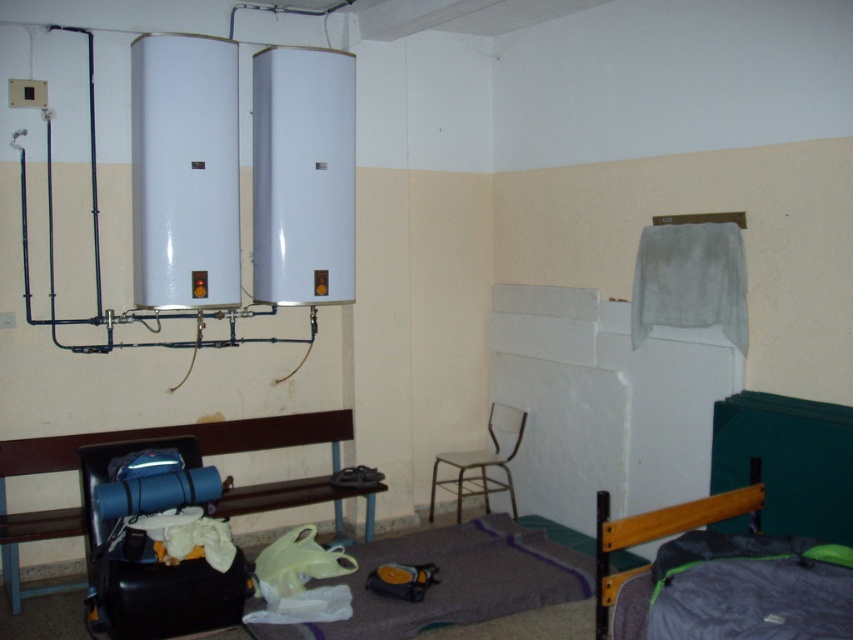
Measure the distance from black leather bench at lower left to metallic white chair at center.

The distance of black leather bench at lower left from metallic white chair at center is 36.89 inches.

Who is higher up, black leather bench at lower left or metallic white chair at center?

black leather bench at lower left is above.

The image size is (853, 640). What do you see at coordinates (137, 440) in the screenshot? I see `black leather bench at lower left` at bounding box center [137, 440].

You are a GUI agent. You are given a task and a screenshot of the screen. Output one action in this format:
    pyautogui.click(x=<x>, y=<y>)
    Task: Click on the black leather bench at lower left
    This screenshot has height=640, width=853.
    Given the screenshot: What is the action you would take?
    pyautogui.click(x=137, y=440)

Does dark gray fabric bed at lower right have a lesser height compared to black leather bench at lower left?

Correct, dark gray fabric bed at lower right is not as tall as black leather bench at lower left.

The width and height of the screenshot is (853, 640). I want to click on dark gray fabric bed at lower right, so click(x=720, y=577).

Is point (820, 611) closer to camera compared to point (24, 440)?

Yes, point (820, 611) is closer to viewer.

You are a GUI agent. You are given a task and a screenshot of the screen. Output one action in this format:
    pyautogui.click(x=<x>, y=<y>)
    Task: Click on the dark gray fabric bed at lower right
    
    Given the screenshot: What is the action you would take?
    tap(720, 577)

Does dark gray fabric bed at lower right have a larger size compared to metallic white chair at center?

Indeed, dark gray fabric bed at lower right has a larger size compared to metallic white chair at center.

Is dark gray fabric bed at lower right to the left of metallic white chair at center from the viewer's perspective?

No, dark gray fabric bed at lower right is not to the left of metallic white chair at center.

Who is more forward, (666, 611) or (479, 468)?

Positioned in front is point (666, 611).

Find the location of a particular element. dark gray fabric bed at lower right is located at coordinates (720, 577).